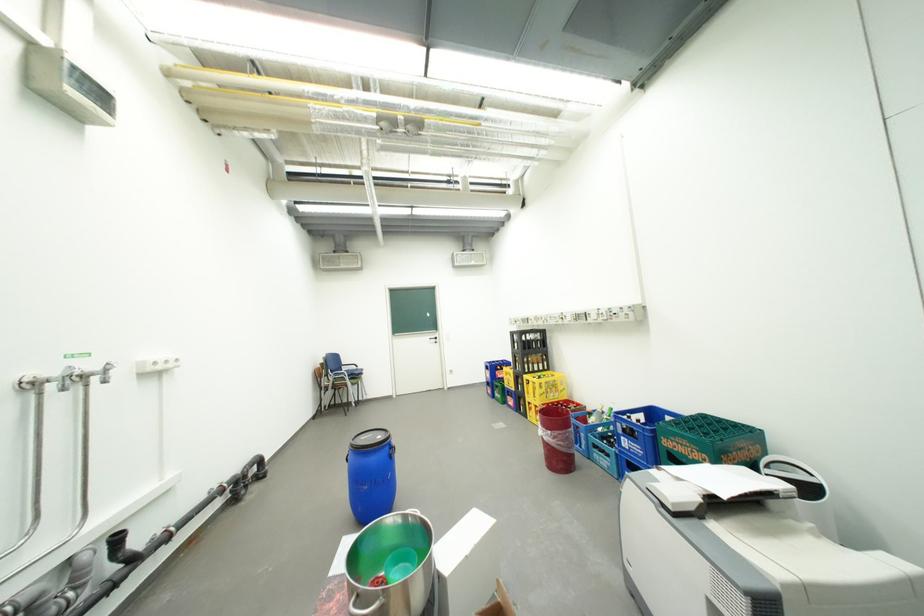
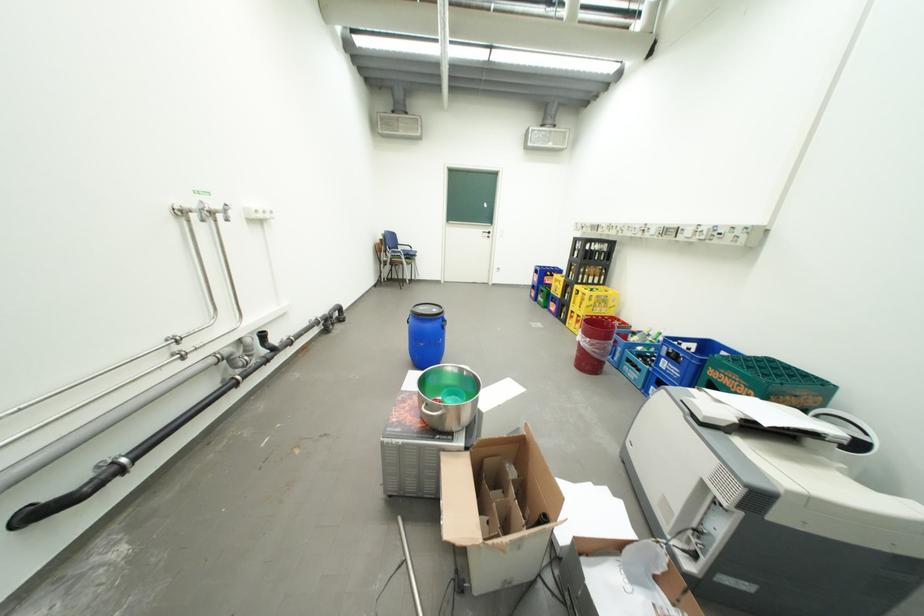
Where in the second image is the point corresponding to point 708,451 from the first image?

(756, 387)